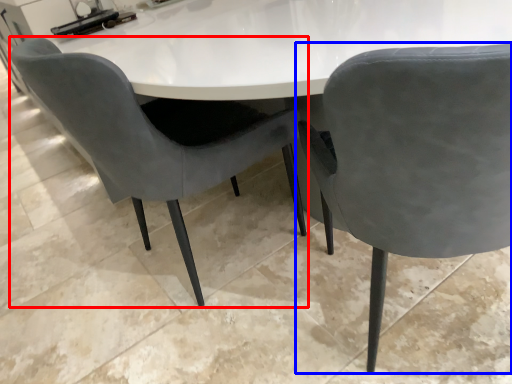
Question: Which of the following is the farthest to the observer, chair (highlighted by a red box) or chair (highlighted by a blue box)?

Choices:
 (A) chair
 (B) chair

Answer: (A)